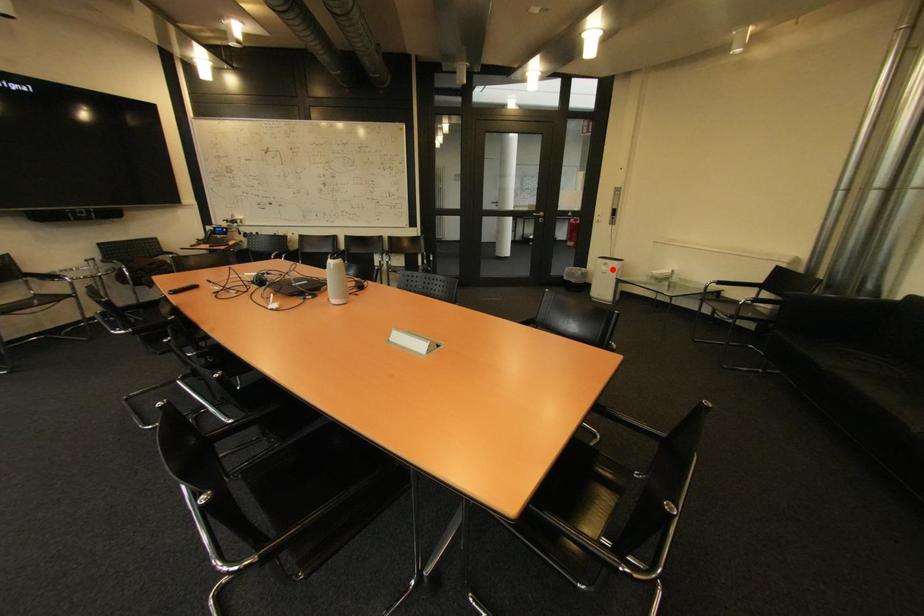
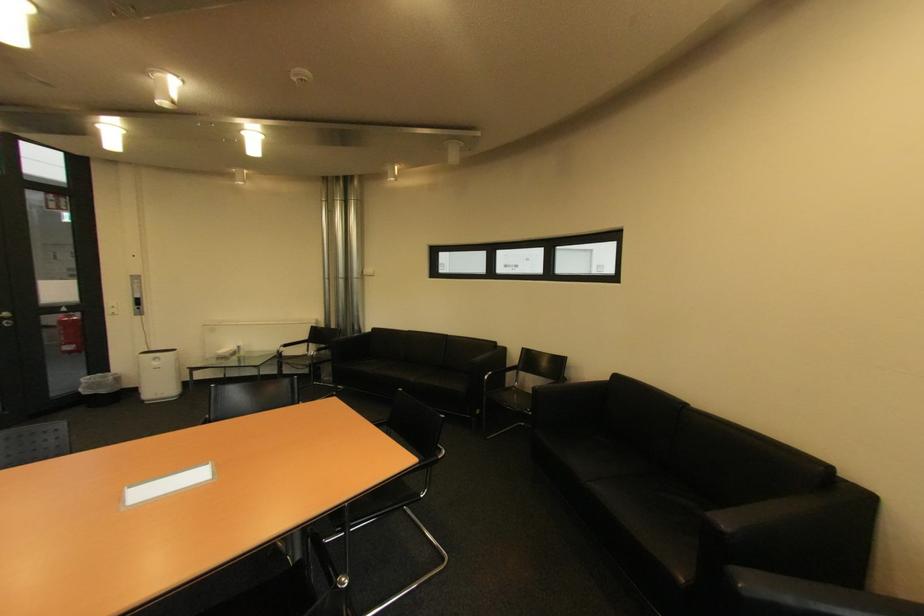
In the second image, find the point that corresponds to the highlighted location in the first image.

(164, 363)